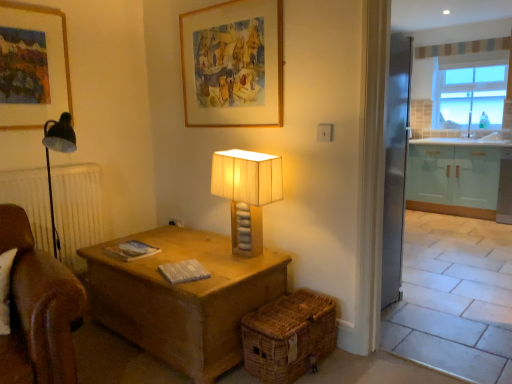
Question: From a real-world perspective, is woven brown basket at lower center physically located above or below clear glass window at upper right?

Choices:
 (A) below
 (B) above

Answer: (A)

Question: From the image's perspective, relative to clear glass window at upper right, is woven brown basket at lower center above or below?

Choices:
 (A) below
 (B) above

Answer: (A)

Question: Based on their relative distances, which object is nearer to the clear glass window at upper right?

Choices:
 (A) wooden picture frame at upper left, the 1th picture frame viewed from the left
 (B) woven brown basket at lower center
 (C) wooden table lamp at center
 (D) white glossy sink at right
 (E) wooden picture frame at upper center, the first picture frame viewed from the right

Answer: (D)

Question: Which object is the closest to the wooden picture frame at upper center, the first picture frame viewed from the right?

Choices:
 (A) woven brown basket at lower center
 (B) wooden table lamp at center
 (C) white glossy sink at right
 (D) clear glass window at upper right
 (E) wooden picture frame at upper left, the 2th picture frame from the right

Answer: (B)